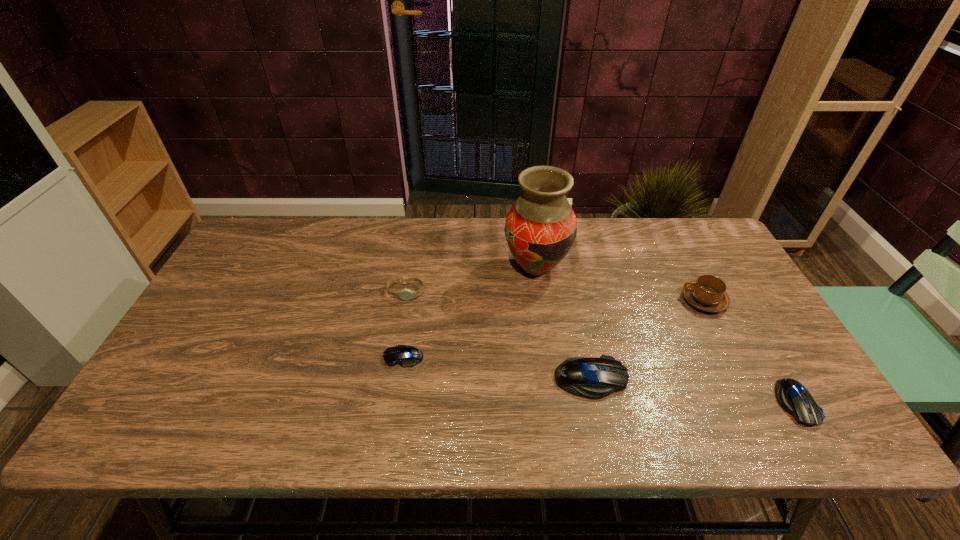
Identify the location of vacant space located on the button side of the shortest computer mouse. (321, 357).

Where is `free space located on the button side of the tallest computer mouse`? This screenshot has height=540, width=960. free space located on the button side of the tallest computer mouse is located at coordinates pyautogui.click(x=685, y=379).

In order to click on vacant position located on the face of the watch in this screenshot , I will do `click(397, 343)`.

Find the location of a particular element. vacant space situated on the left of the vase is located at coordinates (450, 268).

Where is `vacant space located on the side of the fifth shortest object with the handle`? The height and width of the screenshot is (540, 960). vacant space located on the side of the fifth shortest object with the handle is located at coordinates (650, 300).

Where is `vacant region located 0.110m on the side of the fifth shortest object with the handle`? The image size is (960, 540). vacant region located 0.110m on the side of the fifth shortest object with the handle is located at coordinates (643, 300).

Find the location of `blank space located 0.150m on the side of the fifth shortest object with the handle`. blank space located 0.150m on the side of the fifth shortest object with the handle is located at coordinates (630, 300).

Identify the location of object that is positioned at the far edge. (540, 228).

Identify the location of computer mouse at the right edge. The height and width of the screenshot is (540, 960). (792, 396).

The height and width of the screenshot is (540, 960). I want to click on cappuccino that is at the right edge, so click(707, 293).